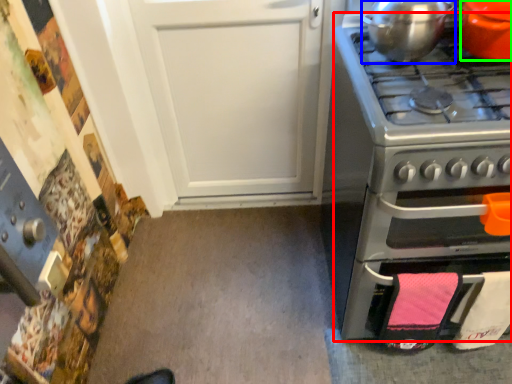
Question: Based on their relative distances, which object is nearer to oven (highlighted by a red box)? Choose from kitchen appliance (highlighted by a blue box) and kitchen appliance (highlighted by a green box).

Choices:
 (A) kitchen appliance
 (B) kitchen appliance

Answer: (A)